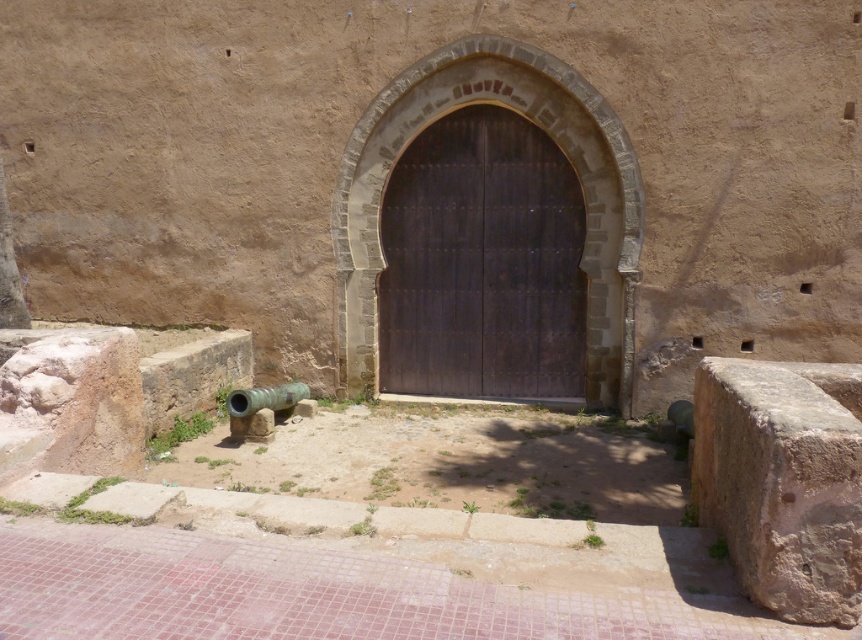
Question: Which of the following is the farthest from the observer?

Choices:
 (A) (759, 577)
 (B) (253, 435)

Answer: (B)

Question: Where is brown rough stone at lower right located in relation to green polished metal cannon at lower left in the image?

Choices:
 (A) above
 (B) below

Answer: (A)

Question: Which point is farther to the camera?

Choices:
 (A) green polished metal cannon at lower left
 (B) brown rough stone at lower right
 (C) dark wood door at center

Answer: (C)

Question: Considering the real-world distances, which object is farthest from the dark wood door at center?

Choices:
 (A) green polished metal cannon at lower left
 (B) brown rough stone at lower right

Answer: (B)

Question: Does dark wood door at center appear on the left side of brown rough stone at lower right?

Choices:
 (A) no
 (B) yes

Answer: (B)

Question: Is dark wood door at center above brown rough stone at lower right?

Choices:
 (A) yes
 (B) no

Answer: (A)